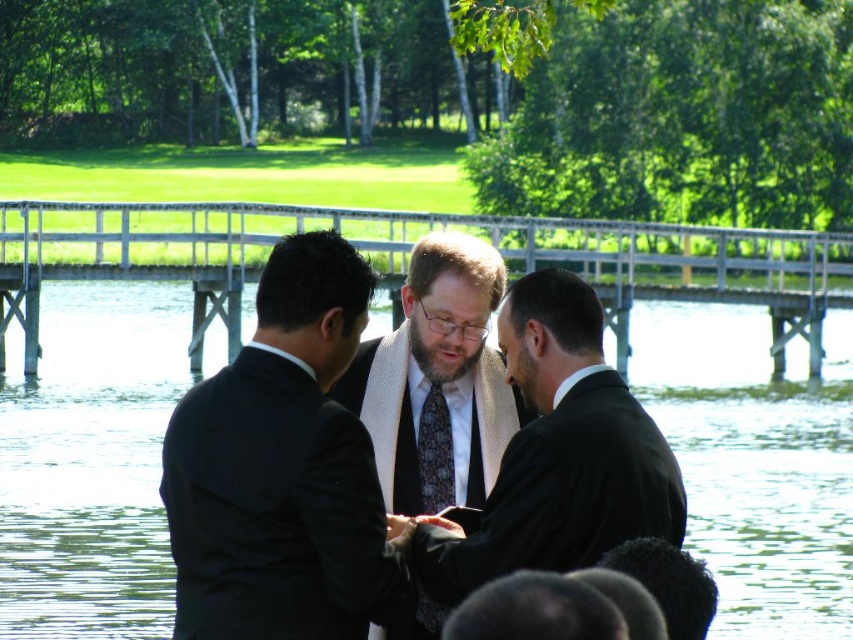
Question: Estimate the real-world distances between objects in this image. Which object is closer to the multicolored patterned tie at center?

Choices:
 (A) patterned silk tie at center
 (B) white wooden dock at center
 (C) transparent water at center

Answer: (A)

Question: Considering the relative positions of transparent water at center and multicolored patterned tie at center in the image provided, where is transparent water at center located with respect to multicolored patterned tie at center?

Choices:
 (A) right
 (B) left

Answer: (B)

Question: Does black suit at center appear over matte black suit at center?

Choices:
 (A) yes
 (B) no

Answer: (A)

Question: Among these points, which one is nearest to the camera?

Choices:
 (A) (799, 275)
 (B) (473, 298)
 (C) (432, 497)
 (D) (265, 624)

Answer: (D)

Question: Which object appears closest to the camera in this image?

Choices:
 (A) matte black suit at center
 (B) white textured shawl at center

Answer: (A)

Question: Is patterned silk tie at center positioned behind multicolored patterned tie at center?

Choices:
 (A) yes
 (B) no

Answer: (A)